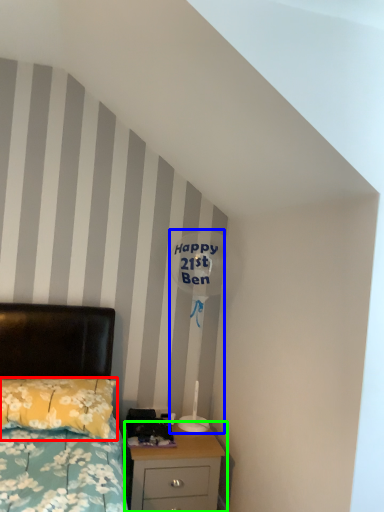
Question: Which object is the farthest from pillow (highlighted by a red box)? Choose among these: table lamp (highlighted by a blue box) or nightstand (highlighted by a green box).

Choices:
 (A) table lamp
 (B) nightstand

Answer: (A)